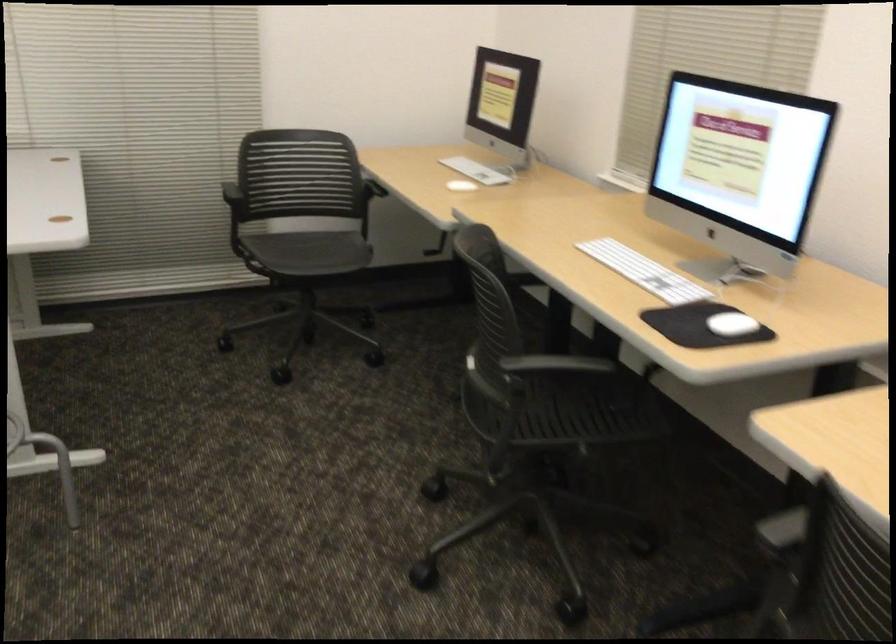
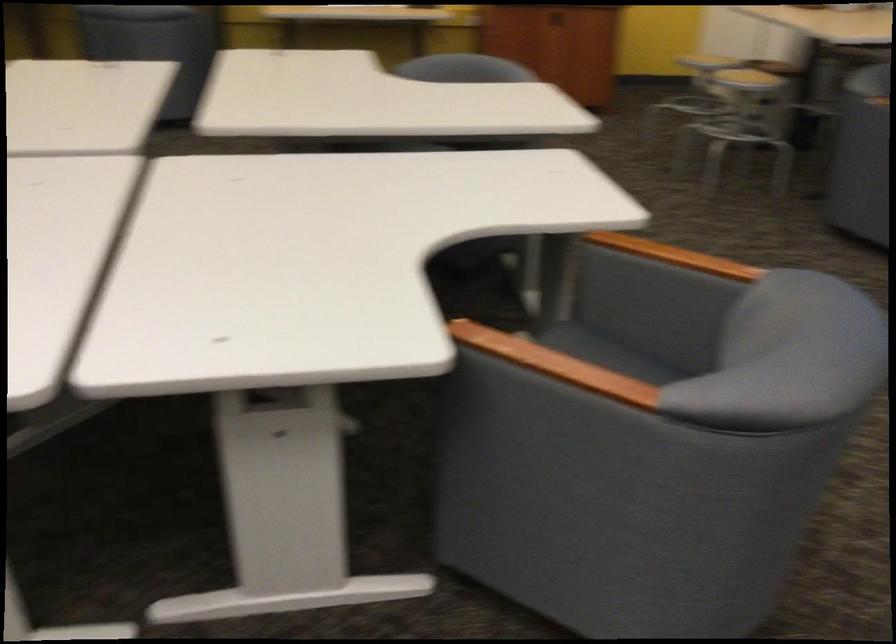
Based on the continuous images, in which direction is the camera rotating?

The camera's rotation is toward left-down.